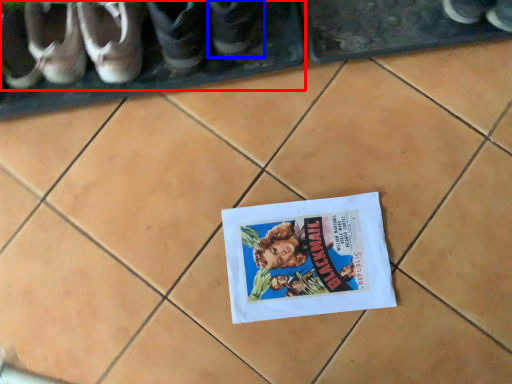
Question: Among these objects, which one is farthest to the camera, footwear (highlighted by a red box) or footwear (highlighted by a blue box)?

Choices:
 (A) footwear
 (B) footwear

Answer: (A)